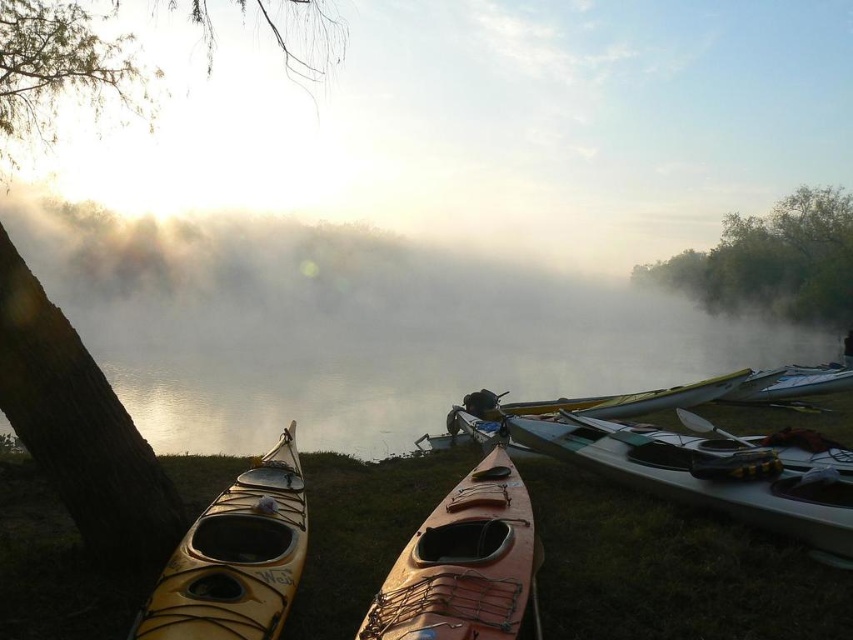
You are a photographer planning to take a photo of the brown rough bark tree at left and the matte white kayak at center. Since you want the tree to appear larger in the photo than the kayak, which object should you move closer to the camera?

The brown rough bark tree at left is much taller than the matte white kayak at center, so to make the tree appear larger in the photo, you should move the brown rough bark tree at left closer to the camera.

You are an observer standing on the riverbank. You see the green leafy tree at upper left and the white glossy kayak at right. Which object is located higher in the image?

The green leafy tree at upper left is positioned over the white glossy kayak at right, so it is higher in the image.

You are a kayaker preparing to launch your boat. You have a 3.5 meter long kayak. There is a gap between the matte white kayak at center and the matte yellow kayak at lower left. Can your kayak fit through this gap?

The gap between the matte white kayak at center and the matte yellow kayak at lower left is 3.35 meters. Since your kayak is 3.5 meters long, it is slightly longer than the gap. Therefore, your kayak cannot fit through the gap.